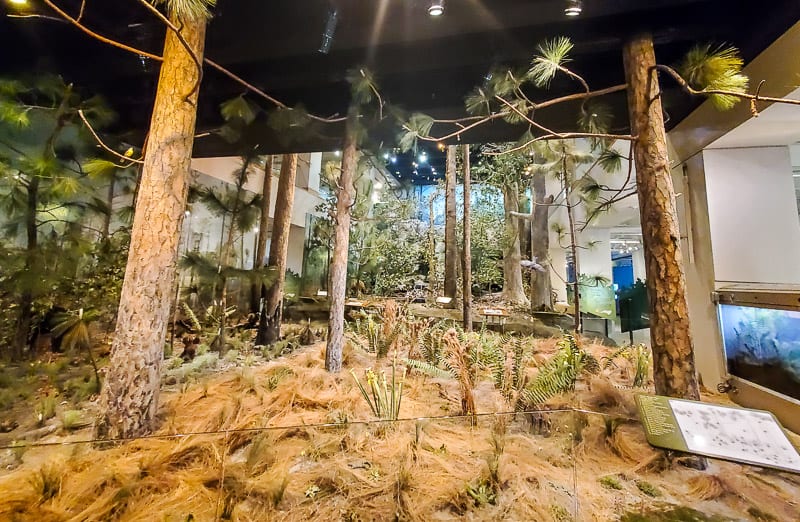
You are a GUI agent. You are given a task and a screenshot of the screen. Output one action in this format:
    pyautogui.click(x=<x>, y=<y>)
    Task: Click on the glass enclosure
    
    Given the screenshot: What is the action you would take?
    pyautogui.click(x=566, y=409)